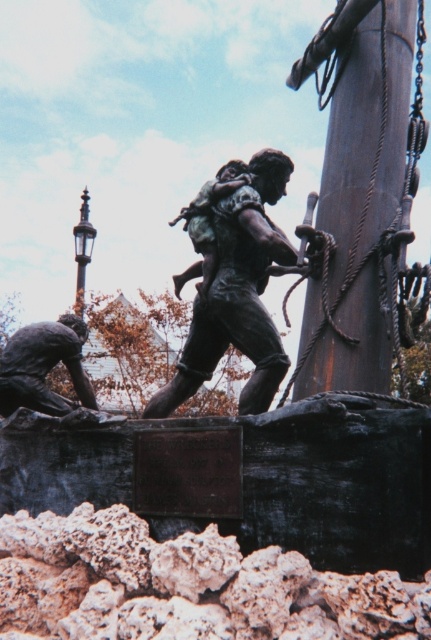
Question: Which of the following is the closest to the observer?

Choices:
 (A) rusty wood pole at right
 (B) bronze statue at center

Answer: (A)

Question: Which of the following is the farthest from the observer?

Choices:
 (A) bronze statue at lower left
 (B) rusty metal rock at lower center
 (C) bronze/brass streetlamp at upper left
 (D) rusty wood pole at right

Answer: (C)

Question: Does bronze statue at center appear under bronze/brass streetlamp at upper left?

Choices:
 (A) no
 (B) yes

Answer: (B)

Question: Does bronze statue at center have a greater width compared to bronze/brass streetlamp at upper left?

Choices:
 (A) no
 (B) yes

Answer: (B)

Question: Observing the image, what is the correct spatial positioning of rusty metal rock at lower center in reference to rusty wood pole at right?

Choices:
 (A) above
 (B) below

Answer: (B)

Question: Which point is closer to the camera taking this photo?

Choices:
 (A) (214, 580)
 (B) (5, 365)
 (C) (321, 202)

Answer: (A)